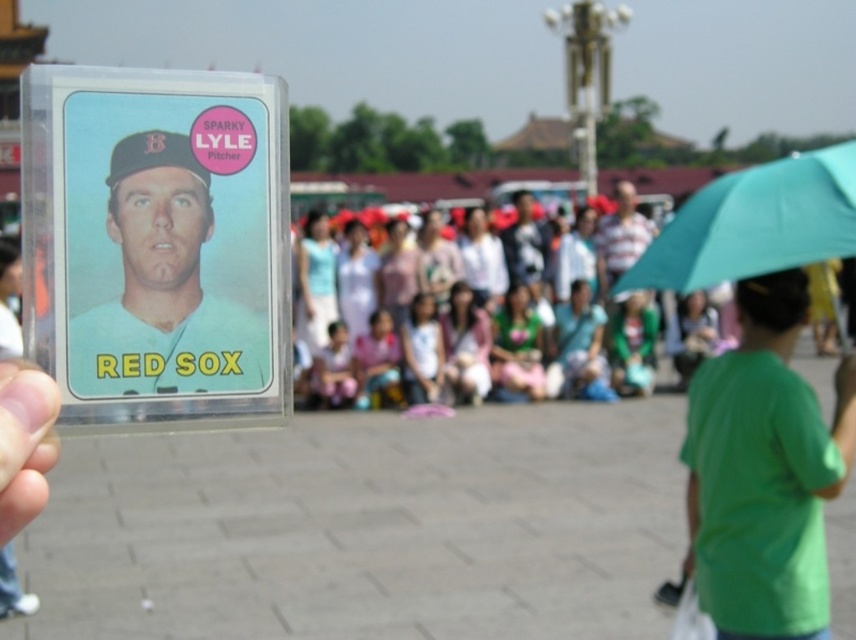
You are holding a clear plastic card at lower left and notice a green matte shirt at lower right in the image. Which object takes up more space in the picture?

The green matte shirt at lower right is bigger than the clear plastic card at lower left, so it takes up more space in the picture.

You are looking at the baseball card and notice the green matte shirt at lower right. Where exactly is the green matte shirt positioned on the card?

The green matte shirt at lower right is located at point coordinates of [764,472].

From the picture: You are a photographer trying to capture a photo of the clear plastic card at lower left without including the green matte shirt at lower right in the frame. Given their distance apart, is this possible?

The green matte shirt at lower right and clear plastic card at lower left are 5.18 meters apart, so yes, it is possible to capture a photo of the clear plastic card at lower left without including the green matte shirt at lower right in the frame since they are sufficiently far apart.